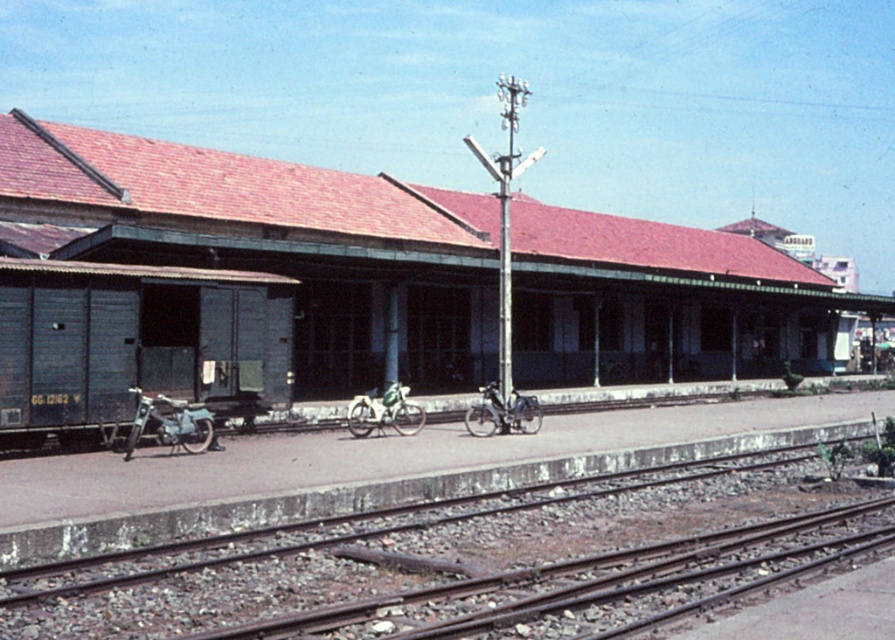
Which is below, brown metal tracks at lower center or green matte bicycle at center?

brown metal tracks at lower center

Based on the photo, between brown metal tracks at lower center and green matte bicycle at center, which one appears on the left side from the viewer's perspective?

Positioned to the left is green matte bicycle at center.

Does point (103, 614) come behind point (374, 422)?

No.

Image resolution: width=895 pixels, height=640 pixels. In order to click on brown metal tracks at lower center in this screenshot , I will do `click(467, 560)`.

Who is lower down, blue wooden train at left or green matte bicycle at center?

green matte bicycle at center is lower down.

Does blue wooden train at left appear on the left side of green matte bicycle at center?

Indeed, blue wooden train at left is positioned on the left side of green matte bicycle at center.

I want to click on blue wooden train at left, so click(x=135, y=342).

At what (x,y) coordinates should I click in order to perform the action: click on blue wooden train at left. Please return your answer as a coordinate pair (x, y). Looking at the image, I should click on (135, 342).

Does blue wooden train at left appear on the right side of metallic blue bicycle at left?

In fact, blue wooden train at left is to the left of metallic blue bicycle at left.

Does blue wooden train at left have a lesser width compared to metallic blue bicycle at left?

Yes, blue wooden train at left is thinner than metallic blue bicycle at left.

Describe the element at coordinates (135, 342) in the screenshot. I see `blue wooden train at left` at that location.

You are a GUI agent. You are given a task and a screenshot of the screen. Output one action in this format:
    pyautogui.click(x=<x>, y=<y>)
    Task: Click on the blue wooden train at left
    
    Given the screenshot: What is the action you would take?
    pyautogui.click(x=135, y=342)